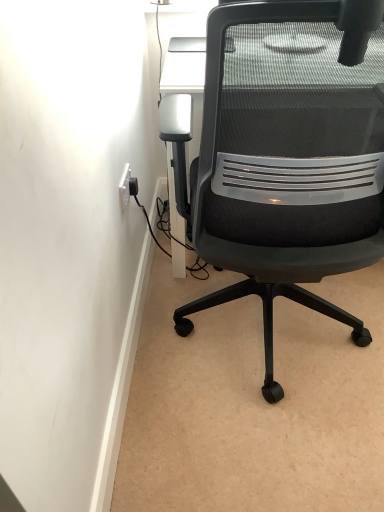
Question: Is black mesh office chair at center in front of or behind white plastic electric outlet at upper left in the image?

Choices:
 (A) front
 (B) behind

Answer: (A)

Question: From the image's perspective, is black mesh office chair at center above or below white plastic electric outlet at upper left?

Choices:
 (A) below
 (B) above

Answer: (A)

Question: Based on their positions, is black mesh office chair at center located to the left or right of white plastic electric outlet at upper left?

Choices:
 (A) left
 (B) right

Answer: (B)

Question: Is white plastic electric outlet at upper left inside the boundaries of black mesh office chair at center, or outside?

Choices:
 (A) outside
 (B) inside

Answer: (A)

Question: In terms of width, does white plastic electric outlet at upper left look wider or thinner when compared to black mesh office chair at center?

Choices:
 (A) wide
 (B) thin

Answer: (B)

Question: In terms of size, does white plastic electric outlet at upper left appear bigger or smaller than black mesh office chair at center?

Choices:
 (A) big
 (B) small

Answer: (B)

Question: Is white plastic electric outlet at upper left in front of or behind black mesh office chair at center in the image?

Choices:
 (A) front
 (B) behind

Answer: (B)